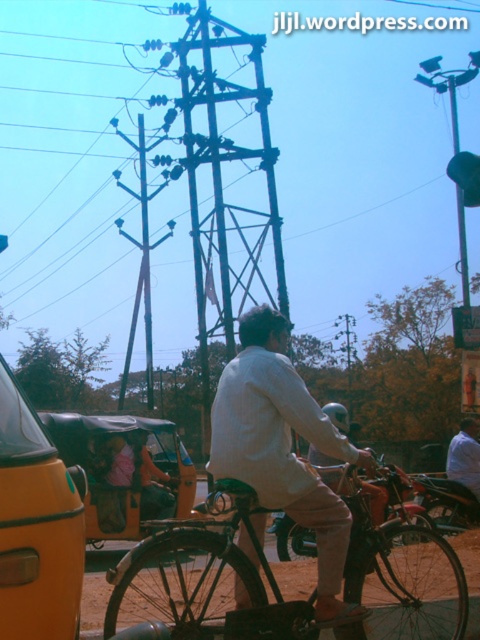
Question: Does light beige fabric shirt at center have a larger size compared to yellow matte taxi at left?

Choices:
 (A) no
 (B) yes

Answer: (B)

Question: Which of the following is the closest to the observer?

Choices:
 (A) yellow matte taxi at left
 (B) shiny chrome motorcycle at center

Answer: (A)

Question: Observing the image, what is the correct spatial positioning of yellow matte taxi at left in reference to shiny chrome motorcycle at center?

Choices:
 (A) above
 (B) below

Answer: (A)

Question: Is metallic structure at center wider than light brown fabric shirt at center?

Choices:
 (A) yes
 (B) no

Answer: (A)

Question: Which object is closer to the camera taking this photo?

Choices:
 (A) light beige fabric shirt at center
 (B) yellow matte taxi at left

Answer: (B)

Question: Which point appears closest to the camera in this image?

Choices:
 (A) (372, 560)
 (B) (236, 403)

Answer: (A)